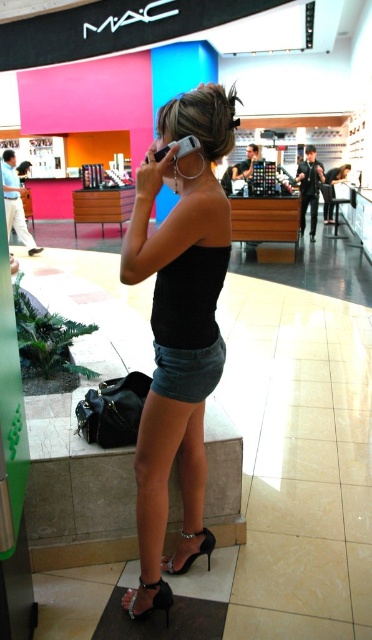
Question: Which point is farther from the camera taking this photo?

Choices:
 (A) (347, 173)
 (B) (181, 362)
 (C) (203, 547)
 (D) (186, 141)

Answer: (A)

Question: Is the position of denim skirt at lower center more distant than that of black leather sandal at lower center?

Choices:
 (A) no
 (B) yes

Answer: (A)

Question: Is matte black phone at upper left above black leather jacket at center?

Choices:
 (A) no
 (B) yes

Answer: (A)

Question: Which of the following is the farthest from the observer?

Choices:
 (A) black patent leather high-heeled sandal at lower center
 (B) white plastic phone at upper center
 (C) matte black tank top at center
 (D) black leather sandal at lower center

Answer: (C)

Question: Which object appears farthest from the camera in this image?

Choices:
 (A) black patent leather high-heeled sandal at lower center
 (B) black leather jacket at center

Answer: (B)

Question: Does denim skirt at lower center have a larger size compared to black patent leather high-heeled sandal at lower center?

Choices:
 (A) yes
 (B) no

Answer: (A)